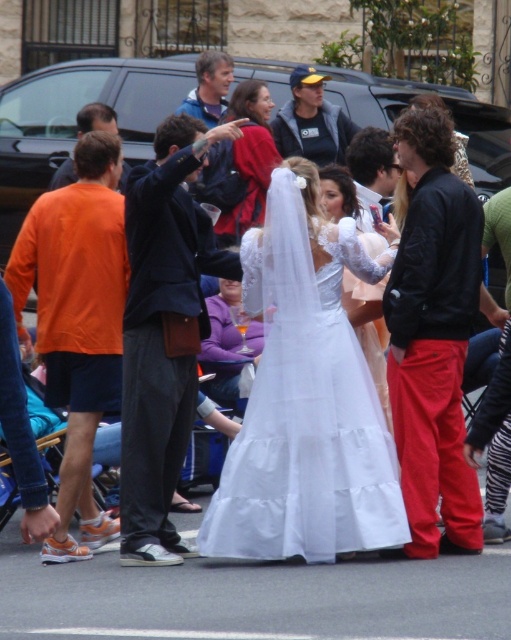
Question: Is red cotton pants at center positioned behind white satin dress at center?

Choices:
 (A) no
 (B) yes

Answer: (A)

Question: Can you confirm if white satin dress at center is positioned to the right of dark gray jacket at upper center?

Choices:
 (A) yes
 (B) no

Answer: (A)

Question: Considering the real-world distances, which object is closest to the white satin dress at center?

Choices:
 (A) red cotton pants at center
 (B) matte red coat at upper center

Answer: (A)

Question: Does white tulle dress at center have a lesser width compared to red cotton pants at center?

Choices:
 (A) no
 (B) yes

Answer: (A)

Question: Estimate the real-world distances between objects in this image. Which object is closer to the matte red coat at upper center?

Choices:
 (A) dark blue fabric jacket at center
 (B) orange fabric shirt at left
 (C) orange fabric pants at left
 (D) black leather jacket at right

Answer: (B)

Question: Among these objects, which one is farthest from the camera?

Choices:
 (A) matte red coat at upper center
 (B) orange fabric pants at left
 (C) dark blue fabric jacket at center
 (D) orange fabric shirt at left

Answer: (A)